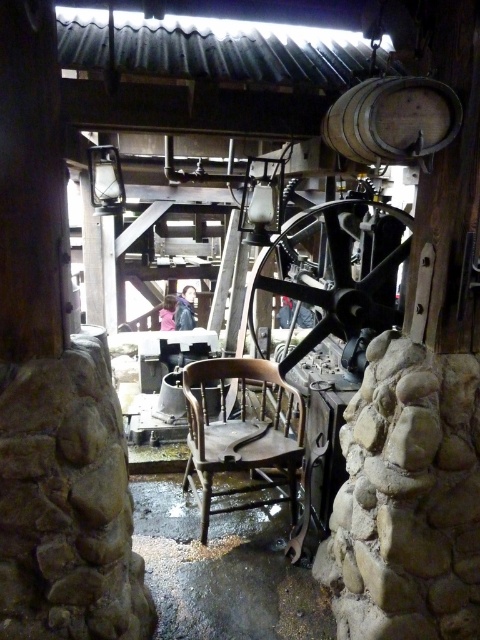
The width and height of the screenshot is (480, 640). What do you see at coordinates (242, 433) in the screenshot? I see `wooden chair at center` at bounding box center [242, 433].

Is wooden chair at center further to camera compared to wooden barrel at upper center?

That is True.

What do you see at coordinates (242, 433) in the screenshot? I see `wooden chair at center` at bounding box center [242, 433].

Where is `wooden chair at center`? wooden chair at center is located at coordinates (242, 433).